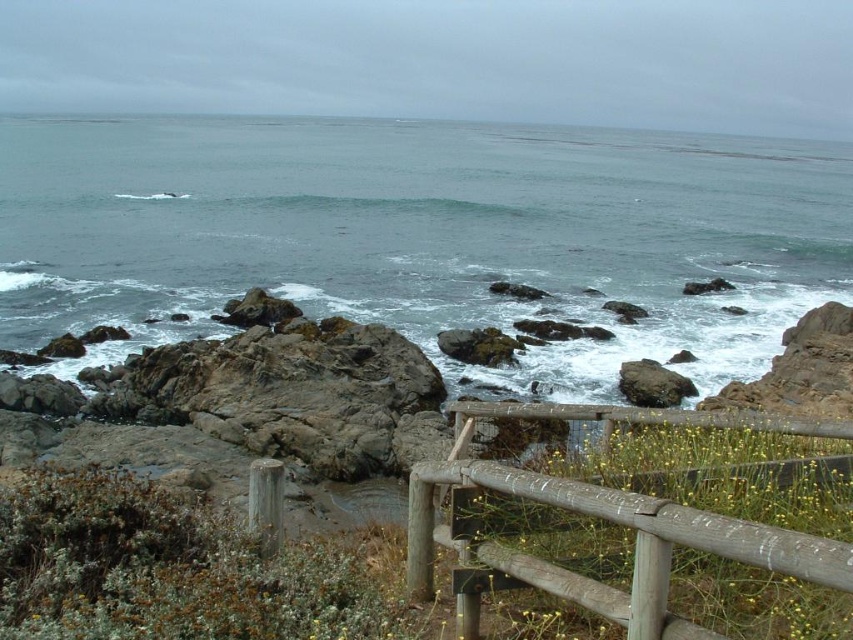
Question: Can you confirm if gray rock at center is wider than brown wooden fence at center?

Choices:
 (A) no
 (B) yes

Answer: (B)

Question: Which of the following is the farthest from the observer?

Choices:
 (A) brown wooden fence at center
 (B) gray rock at center

Answer: (B)

Question: In this image, where is gray rock at center located relative to brown wooden fence at center?

Choices:
 (A) right
 (B) left

Answer: (A)

Question: Which of the following is the farthest from the observer?

Choices:
 (A) click(x=316, y=300)
 (B) click(x=631, y=500)

Answer: (A)

Question: Does gray rock at center lie in front of brown wooden fence at center?

Choices:
 (A) yes
 (B) no

Answer: (B)